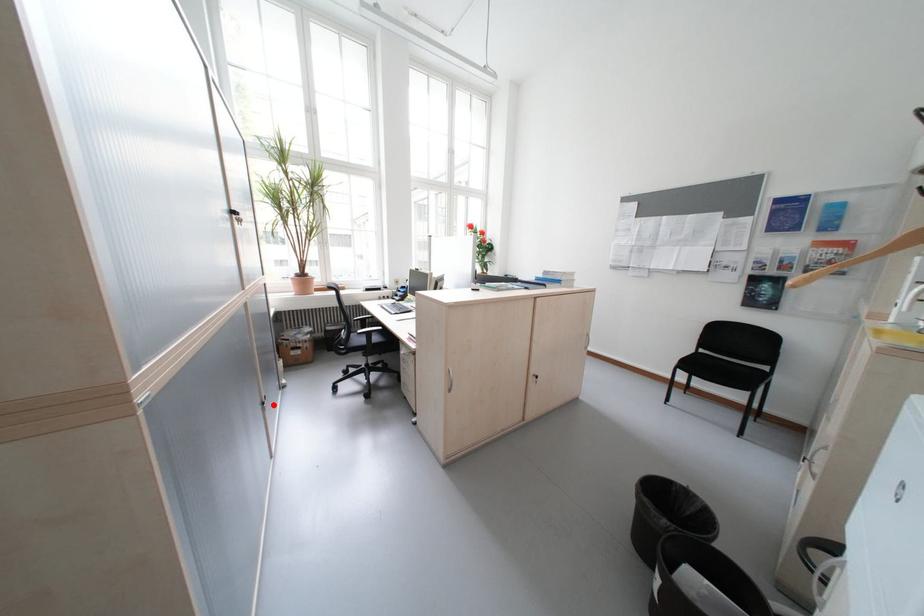
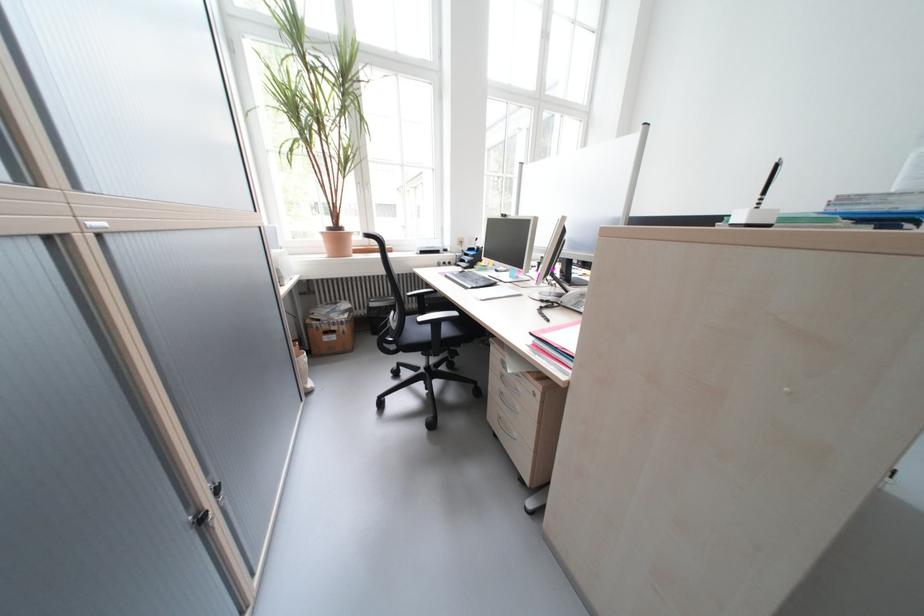
Find the pixel in the second image that matches the highlighted location in the first image.

(213, 521)